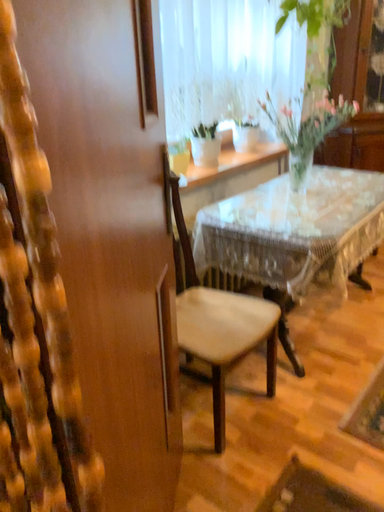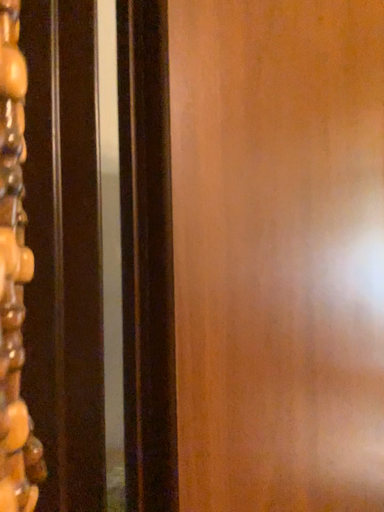
Question: Which way did the camera rotate in the video?

Choices:
 (A) rotated downward
 (B) rotated upward

Answer: (B)